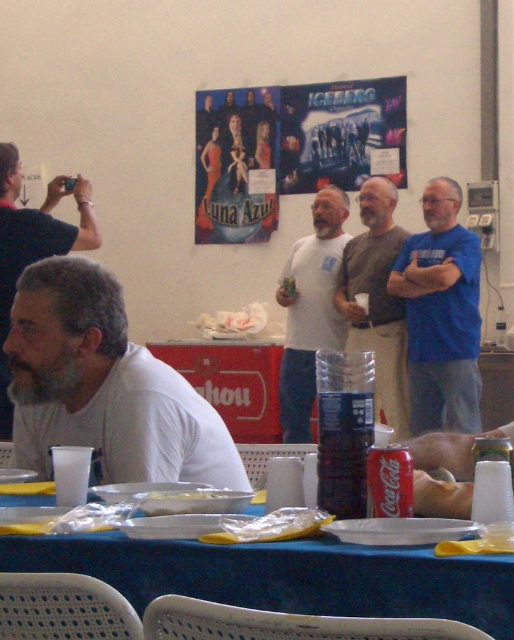
Is white matte shirt at left wider than white matte t-shirt at center?

Yes.

Is white matte shirt at left to the left of white matte t-shirt at center from the viewer's perspective?

Correct, you'll find white matte shirt at left to the left of white matte t-shirt at center.

Locate an element on the screen. white matte shirt at left is located at coordinates (103, 387).

You are a GUI agent. You are given a task and a screenshot of the screen. Output one action in this format:
    pyautogui.click(x=<x>, y=<y>)
    Task: Click on the white matte shirt at left
    The width and height of the screenshot is (514, 640).
    Given the screenshot: What is the action you would take?
    pyautogui.click(x=103, y=387)

Can you confirm if white matte shirt at left is positioned above gray beard at left?

Actually, white matte shirt at left is below gray beard at left.

How much distance is there between white matte shirt at left and gray beard at left?

4.68 feet

Which is in front, point (75, 337) or point (12, 204)?

Positioned in front is point (75, 337).

Find the location of a particular element. white matte shirt at left is located at coordinates (103, 387).

Is white matte shirt at left further to the viewer compared to gray fabric shirt at center?

No, it is in front of gray fabric shirt at center.

Does point (237, 476) come farther from viewer compared to point (391, 230)?

No.

In order to click on white matte shirt at left in this screenshot , I will do `click(103, 387)`.